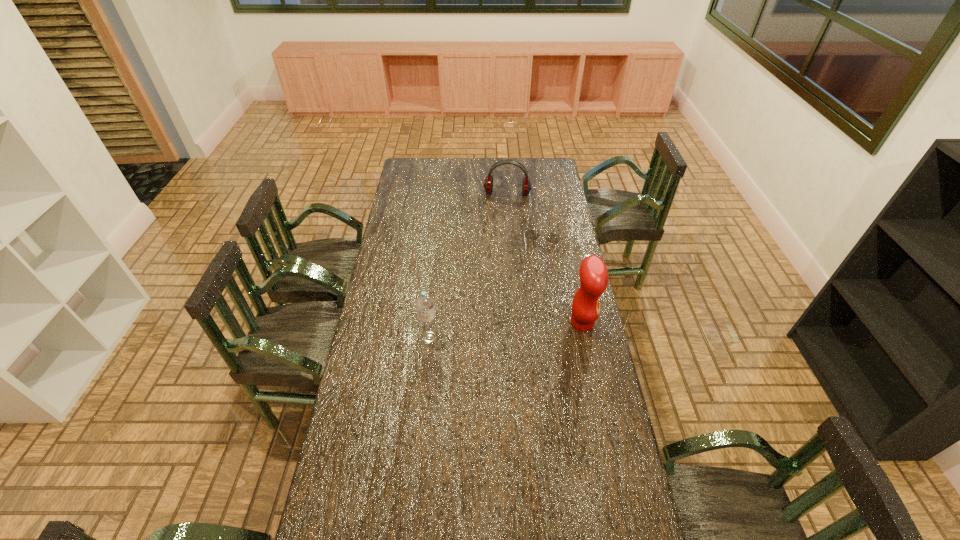
The width and height of the screenshot is (960, 540). In order to click on free space at the far left corner in this screenshot , I will do `click(429, 173)`.

In the image, there is a desktop. Identify the location of vacant space at the far right corner. (541, 170).

Find the location of a particular element. This screenshot has width=960, height=540. blank space at the near right corner of the desktop is located at coordinates (603, 510).

This screenshot has width=960, height=540. I want to click on vacant space that's between the third shortest object and the condiment, so click(506, 330).

Find the location of a particular element. This screenshot has height=540, width=960. free spot between the farthest object and the shortest object is located at coordinates [x=525, y=222].

Locate an element on the screen. Image resolution: width=960 pixels, height=540 pixels. free space between the water bottle and the earphone is located at coordinates (468, 266).

Image resolution: width=960 pixels, height=540 pixels. In order to click on blank region between the farthest object and the tallest object in this screenshot , I will do `click(544, 259)`.

At what (x,y) coordinates should I click in order to perform the action: click on vacant space that is in between the earphone and the condiment. Please return your answer as a coordinate pair (x, y). Looking at the image, I should click on (544, 259).

In order to click on free spot between the second tallest object and the tallest object in this screenshot , I will do `click(506, 330)`.

Locate an element on the screen. This screenshot has width=960, height=540. free space between the third shortest object and the second farthest object is located at coordinates (487, 294).